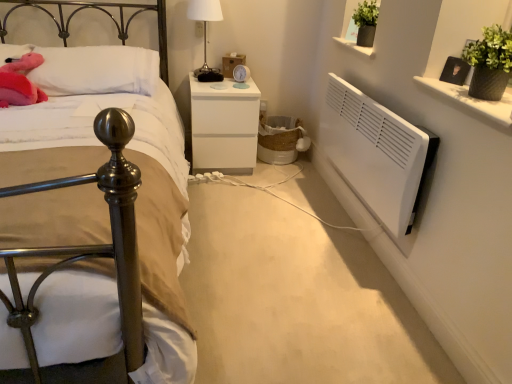
Question: In the image, is fluffy pink plush at upper left positioned in front of or behind white soft pillow at upper left?

Choices:
 (A) front
 (B) behind

Answer: (A)

Question: From the image's perspective, is fluffy pink plush at upper left positioned above or below white soft pillow at upper left?

Choices:
 (A) above
 (B) below

Answer: (B)

Question: Estimate the real-world distances between objects in this image. Which object is closer to the white matte nightstand at center?

Choices:
 (A) white glossy vase at upper right
 (B) fluffy pink plush at upper left
 (C) white soft pillow at upper left
 (D) white glossy table lamp at upper center
 (E) metallic bed at left

Answer: (D)

Question: Which object is the closest to the white glossy vase at upper right?

Choices:
 (A) white glossy table lamp at upper center
 (B) white matte nightstand at center
 (C) white soft pillow at upper left
 (D) metallic bed at left
 (E) fluffy pink plush at upper left

Answer: (D)